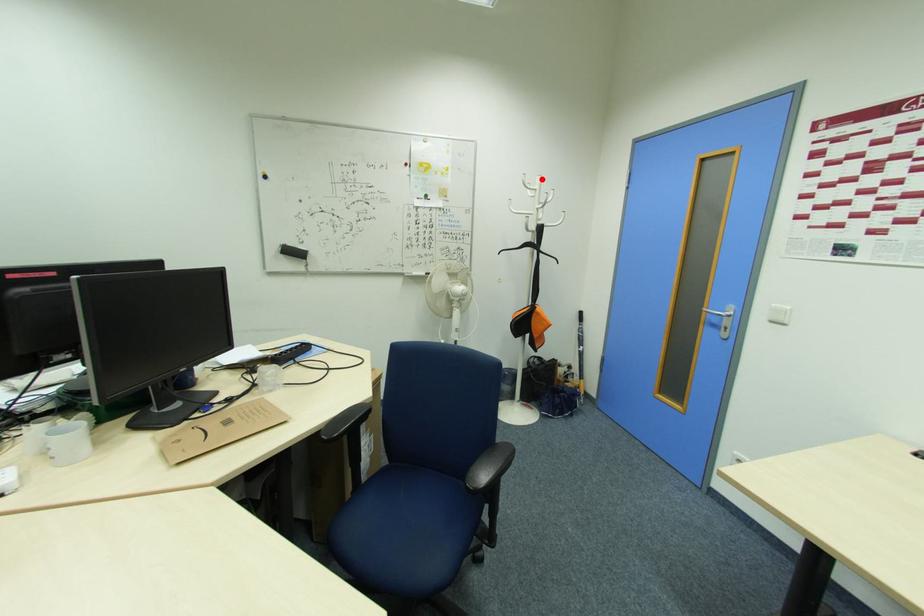
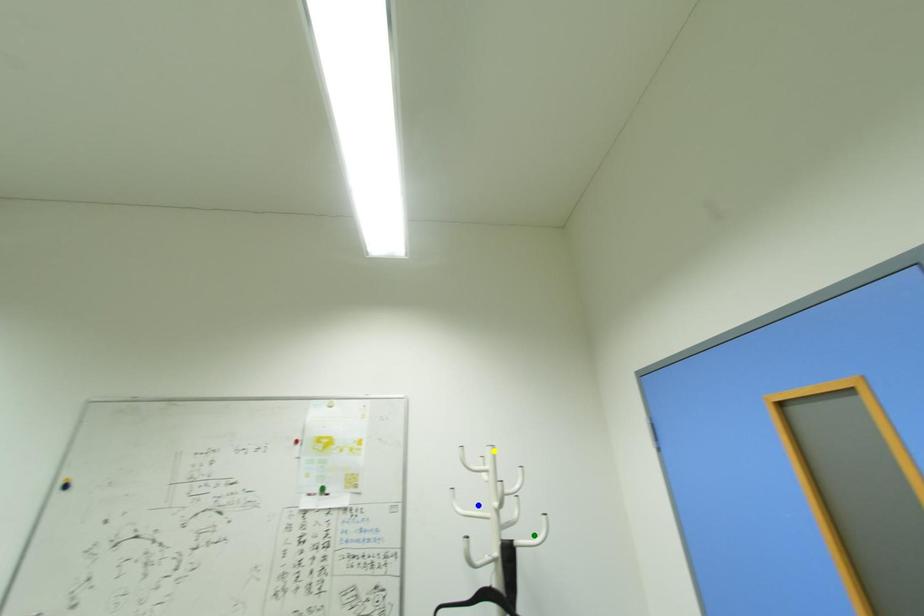
Question: I am providing you with two images of the same scene from different viewpoints. A red point is marked on the first image. You are given multiple points on the second image. Which point in image 2 is actually the same real-world point as the red point in image 1?

Choices:
 (A) green point
 (B) yellow point
 (C) blue point

Answer: (B)